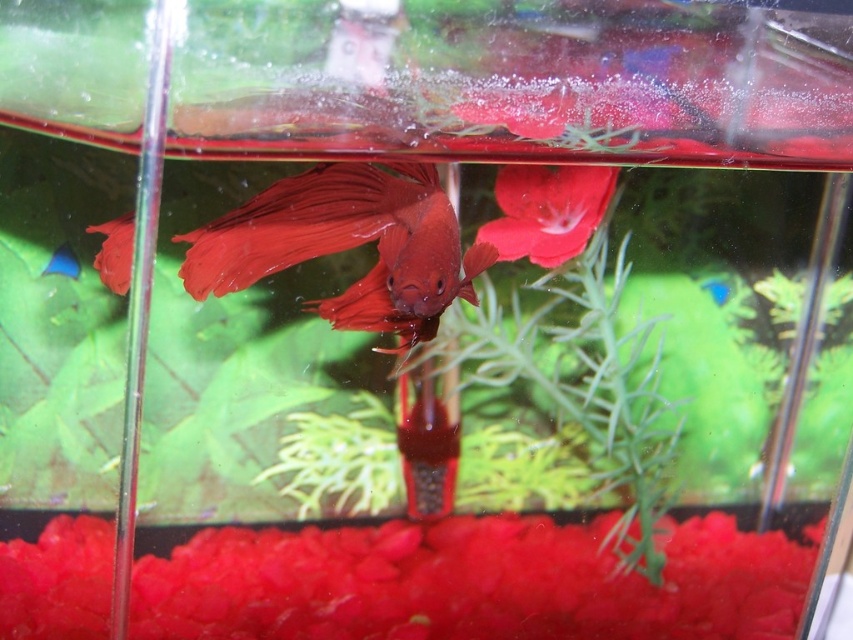
You are an aquatic photographer trying to capture the shiny red fish at center and the matte red fish at center in the same frame. Which fish is located to the right of the other?

The shiny red fish at center is positioned on the right side of the matte red fish at center.

You are an underwater photographer aiming to capture the shiny red fish at center and the matte red fish at center. Which fish should you focus on first to ensure both are in the same frame?

You should focus on the shiny red fish at center first because it is closer to the viewer than the matte red fish at center, allowing you to adjust the camera to include both in the frame.